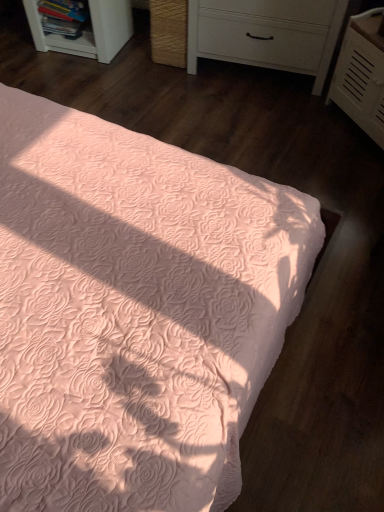
This screenshot has width=384, height=512. What are the coordinates of `unoccupied area in front of white textured chest of drawers at upper right, which ranks as the 1th chest of drawers in right-to-left order` in the screenshot? It's located at point(349,173).